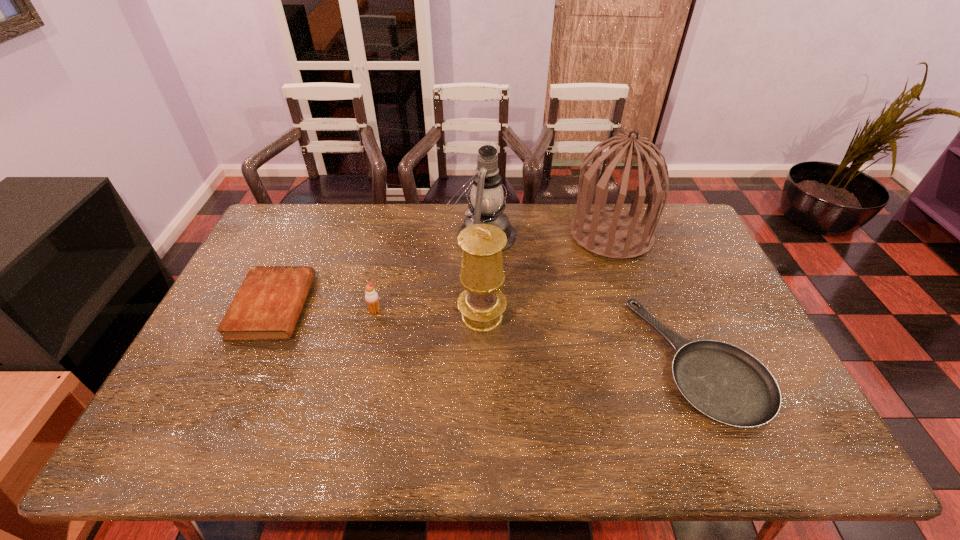
I want to click on birdcage, so click(609, 232).

Locate an element on the screen. the farther oil lamp is located at coordinates (486, 206).

This screenshot has width=960, height=540. What are the coordinates of `the nearer oil lamp` in the screenshot? It's located at (481, 304).

You are a GUI agent. You are given a task and a screenshot of the screen. Output one action in this format:
    pyautogui.click(x=<x>, y=<y>)
    Task: Click on the fourth tallest object
    The height and width of the screenshot is (540, 960).
    Given the screenshot: What is the action you would take?
    pyautogui.click(x=371, y=296)

This screenshot has width=960, height=540. Identify the location of icecream. (371, 296).

You are a GUI agent. You are given a task and a screenshot of the screen. Output one action in this format:
    pyautogui.click(x=<x>, y=<y>)
    Task: Click on the Bible
    This screenshot has width=960, height=540.
    Given the screenshot: What is the action you would take?
    pyautogui.click(x=267, y=306)

The width and height of the screenshot is (960, 540). Find the location of `the second shortest object`. the second shortest object is located at coordinates (267, 306).

The width and height of the screenshot is (960, 540). Identify the location of frying pan. (725, 383).

This screenshot has width=960, height=540. What are the coordinates of `free region located on the front of the birdcage` in the screenshot? It's located at (635, 305).

This screenshot has height=540, width=960. Find the location of `free space located on the right of the farther oil lamp`. free space located on the right of the farther oil lamp is located at coordinates (533, 234).